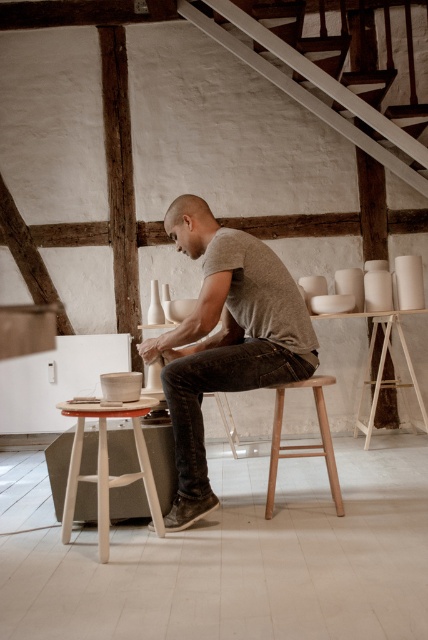
Which of these two, gray matte t-shirt at center or light brown wooden stool at center, stands shorter?

Standing shorter between the two is light brown wooden stool at center.

Measure the distance between gray matte t-shirt at center and light brown wooden stool at center.

gray matte t-shirt at center is 17.00 inches from light brown wooden stool at center.

Where is `gray matte t-shirt at center`? The image size is (428, 640). gray matte t-shirt at center is located at coordinates (225, 339).

Locate an element on the screen. gray matte t-shirt at center is located at coordinates (225, 339).

Is gray matte t-shirt at center taller than white wood stool at center?

Yes, gray matte t-shirt at center is taller than white wood stool at center.

Can you confirm if gray matte t-shirt at center is shorter than white wood stool at center?

No, gray matte t-shirt at center is not shorter than white wood stool at center.

Between point (186, 317) and point (80, 424), which one is positioned in front?

Point (80, 424)

You are a GUI agent. You are given a task and a screenshot of the screen. Output one action in this format:
    pyautogui.click(x=<x>, y=<y>)
    Task: Click on the gray matte t-shirt at center
    
    Given the screenshot: What is the action you would take?
    pyautogui.click(x=225, y=339)

Does white wood stool at center appear on the right side of light brown wooden stool at center?

In fact, white wood stool at center is to the left of light brown wooden stool at center.

I want to click on white wood stool at center, so (x=107, y=467).